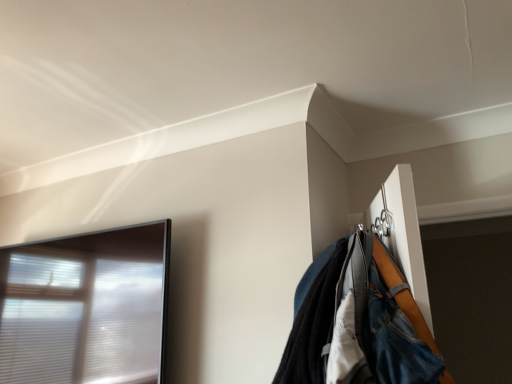
The height and width of the screenshot is (384, 512). What are the coordinates of `denim jacket at upper right` in the screenshot? It's located at (359, 324).

The image size is (512, 384). Describe the element at coordinates (359, 324) in the screenshot. I see `denim jacket at upper right` at that location.

Measure the distance between point (37, 294) and camera.

Point (37, 294) is 6.03 feet from camera.

What is the approximate height of transparent glass window at left?

It is 62.77 centimeters.

What is the approximate width of transparent glass window at left?

transparent glass window at left is 5.03 inches wide.

Identify the location of transparent glass window at left. (85, 307).

What do you see at coordinates (85, 307) in the screenshot?
I see `transparent glass window at left` at bounding box center [85, 307].

Find the location of a particular element. The image size is (512, 384). denim jacket at upper right is located at coordinates (359, 324).

Based on their positions, is transparent glass window at left located to the left or right of denim jacket at upper right?

Based on their positions, transparent glass window at left is located to the left of denim jacket at upper right.

Is the position of transparent glass window at left more distant than that of denim jacket at upper right?

Yes, the depth of transparent glass window at left is greater than that of denim jacket at upper right.

Does point (30, 301) come behind point (415, 381)?

Yes, it is behind point (415, 381).

From the image's perspective, which object appears higher, transparent glass window at left or denim jacket at upper right?

denim jacket at upper right is shown above in the image.

From a real-world perspective, is transparent glass window at left below denim jacket at upper right?

No, from a real-world perspective, transparent glass window at left is not below denim jacket at upper right.

Does transparent glass window at left have a greater width compared to denim jacket at upper right?

No.

Looking at this image, which of these two, transparent glass window at left or denim jacket at upper right, stands taller?

transparent glass window at left.

Which of these two, transparent glass window at left or denim jacket at upper right, is smaller?

denim jacket at upper right is smaller.

Based on the photo, is transparent glass window at left spatially inside denim jacket at upper right, or outside of it?

transparent glass window at left is not enclosed by denim jacket at upper right.

Consider the image. Is transparent glass window at left beside denim jacket at upper right?

No.

Is denim jacket at upper right at the back of transparent glass window at left?

That's not correct — transparent glass window at left is not looking away from denim jacket at upper right.

From the picture: What's the angular difference between transparent glass window at left and denim jacket at upper right's facing directions?

The angle between the facing direction of transparent glass window at left and the facing direction of denim jacket at upper right is 5.91 degrees.

The image size is (512, 384). In order to click on window on the left of denim jacket at upper right in this screenshot , I will do `click(85, 307)`.

Can you confirm if denim jacket at upper right is positioned to the right of transparent glass window at left?

Yes.

Is the position of denim jacket at upper right more distant than that of transparent glass window at left?

No, the depth of denim jacket at upper right is less than that of transparent glass window at left.

Which is less distant, [401,361] or [130,275]?

Point [401,361] appears to be closer to the viewer than point [130,275].

From the image's perspective, which object appears higher, denim jacket at upper right or transparent glass window at left?

From the image's view, denim jacket at upper right is above.

From a real-world perspective, is denim jacket at upper right positioned above or below transparent glass window at left?

From a real-world perspective, denim jacket at upper right is physically below transparent glass window at left.

Which of these two, denim jacket at upper right or transparent glass window at left, is thinner?

Thinner between the two is transparent glass window at left.

Is denim jacket at upper right taller than transparent glass window at left?

No, denim jacket at upper right is not taller than transparent glass window at left.

Based on their sizes in the image, would you say denim jacket at upper right is bigger or smaller than transparent glass window at left?

Considering their sizes, denim jacket at upper right takes up less space than transparent glass window at left.

Do you think denim jacket at upper right is within transparent glass window at left, or outside of it?

denim jacket at upper right is outside transparent glass window at left.

Are denim jacket at upper right and transparent glass window at left making contact?

No, denim jacket at upper right is not next to transparent glass window at left.

Is denim jacket at upper right oriented away from transparent glass window at left?

That's not correct — denim jacket at upper right is not looking away from transparent glass window at left.

Can you tell me how much denim jacket at upper right and transparent glass window at left differ in facing direction?

The facing directions of denim jacket at upper right and transparent glass window at left are 5.91 degrees apart.

Where is `window that appears behind the denim jacket at upper right`? window that appears behind the denim jacket at upper right is located at coordinates (85, 307).

Where is `jacket located above the transparent glass window at left (from the image's perspective)`? This screenshot has height=384, width=512. jacket located above the transparent glass window at left (from the image's perspective) is located at coordinates pos(359,324).

You are a GUI agent. You are given a task and a screenshot of the screen. Output one action in this format:
    pyautogui.click(x=<x>, y=<y>)
    Task: Click on the jacket that is under the transparent glass window at left (from a real-world perspective)
    Image resolution: width=512 pixels, height=384 pixels.
    Given the screenshot: What is the action you would take?
    pyautogui.click(x=359, y=324)